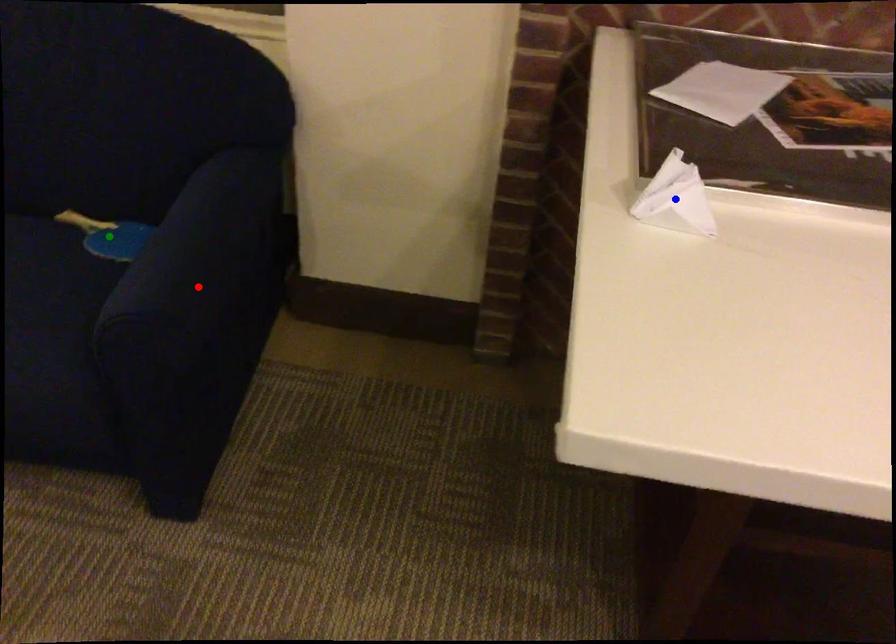
Order these from nearest to farthest:
green point | red point | blue point

blue point < red point < green point